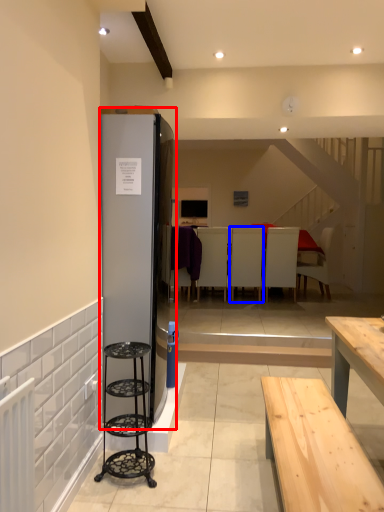
Question: Which object appears farthest to the camera in this image, fridge (highlighted by a red box) or armchair (highlighted by a blue box)?

Choices:
 (A) fridge
 (B) armchair

Answer: (B)